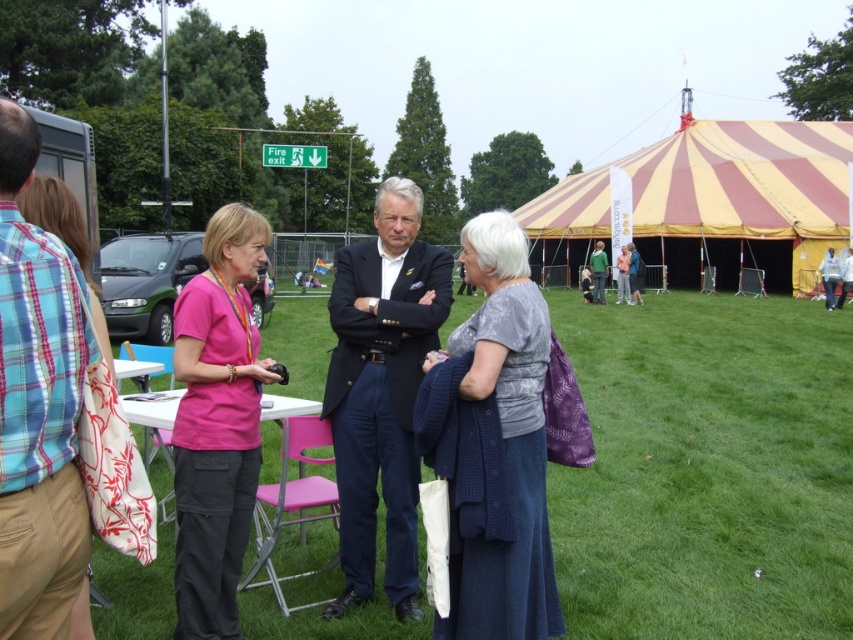
Who is higher up, green grass at center or yellow striped canvas tent at upper right?

yellow striped canvas tent at upper right

Can you confirm if green grass at center is shorter than yellow striped canvas tent at upper right?

Correct, green grass at center is not as tall as yellow striped canvas tent at upper right.

The height and width of the screenshot is (640, 853). I want to click on green grass at center, so click(x=706, y=468).

Between navy blue suit at center and green fabric jacket at center, which one is positioned higher?

green fabric jacket at center is above.

Can you confirm if navy blue suit at center is shorter than green fabric jacket at center?

No.

Where is `navy blue suit at center`? This screenshot has height=640, width=853. navy blue suit at center is located at coordinates (381, 392).

Can you confirm if pink fabric shirt at center is smaller than gray textured dress at center?

No.

Can you confirm if pink fabric shirt at center is taller than gray textured dress at center?

Correct, pink fabric shirt at center is much taller as gray textured dress at center.

Between point (223, 404) and point (515, 225), which one is positioned behind?

Positioned behind is point (223, 404).

Identify the location of pink fabric shirt at center. (218, 422).